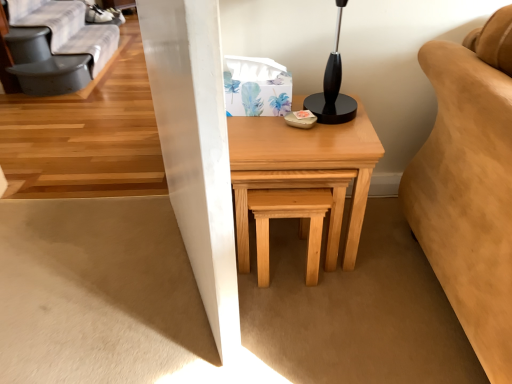
Describe the element at coordinates (311, 156) in the screenshot. This screenshot has height=384, width=512. I see `natural wood table at center` at that location.

The image size is (512, 384). I want to click on natural wood table at center, so click(x=311, y=156).

In order to face gray fabric futon at upper left, should I rotate leftwards or rightwards?

To face it directly, rotate left by 25.510 degrees.

Describe the element at coordinates (56, 45) in the screenshot. I see `gray fabric futon at upper left` at that location.

Find the location of `natural wood table at center`. natural wood table at center is located at coordinates (311, 156).

Which object is positioned more to the left, gray fabric futon at upper left or natural wood table at center?

gray fabric futon at upper left is more to the left.

Which object is thinner, gray fabric futon at upper left or natural wood table at center?

gray fabric futon at upper left.

Is gray fabric futon at upper left aimed at natural wood table at center?

No, gray fabric futon at upper left is not aimed at natural wood table at center.

Does natural wood stool at center appear on the right side of gray fabric futon at upper left?

Indeed, natural wood stool at center is positioned on the right side of gray fabric futon at upper left.

Is natural wood stool at center wider than gray fabric futon at upper left?

No, natural wood stool at center is not wider than gray fabric futon at upper left.

From a real-world perspective, is natural wood stool at center below gray fabric futon at upper left?

Yes, from a real-world perspective, natural wood stool at center is under gray fabric futon at upper left.

From the image's perspective, which is below, gray fabric futon at upper left or natural wood stool at center?

natural wood stool at center is shown below in the image.

Measure the distance between gray fabric futon at upper left and natural wood stool at center.

A distance of 7.24 feet exists between gray fabric futon at upper left and natural wood stool at center.

Based on the photo, does gray fabric futon at upper left touch natural wood stool at center?

No.

Identify the location of futon lying behind the natural wood stool at center. (56, 45).

Can you confirm if natural wood table at center is wider than gray fabric futon at upper left?

Correct, the width of natural wood table at center exceeds that of gray fabric futon at upper left.

Is natural wood table at center outside of gray fabric futon at upper left?

Yes, natural wood table at center is not within gray fabric futon at upper left.

Who is taller, natural wood table at center or gray fabric futon at upper left?

With more height is natural wood table at center.

From the image's perspective, is natural wood table at center above or below gray fabric futon at upper left?

From the image's perspective, natural wood table at center appears below gray fabric futon at upper left.

Is natural wood stool at center beside natural wood table at center?

No, natural wood stool at center is not beside natural wood table at center.

The height and width of the screenshot is (384, 512). I want to click on table positioned vertically above the natural wood stool at center (from a real-world perspective), so click(311, 156).

Considering the positions of objects natural wood stool at center and natural wood table at center in the image provided, who is more to the right, natural wood stool at center or natural wood table at center?

Positioned to the right is natural wood table at center.

Which object is more forward, natural wood table at center or natural wood stool at center?

natural wood table at center is closer to the camera.

Is natural wood table at center oriented towards natural wood stool at center?

Yes, natural wood table at center is aimed at natural wood stool at center.

Which of these two, natural wood table at center or natural wood stool at center, is wider?

With larger width is natural wood table at center.

Can you tell me how much natural wood table at center and natural wood stool at center differ in facing direction?

The facing directions of natural wood table at center and natural wood stool at center are 0.000489 degrees apart.

The height and width of the screenshot is (384, 512). I want to click on table below the gray fabric futon at upper left (from a real-world perspective), so click(x=311, y=156).

Where is `futon above the natural wood stool at center (from a real-world perspective)`? This screenshot has height=384, width=512. futon above the natural wood stool at center (from a real-world perspective) is located at coordinates (56, 45).

Estimate the real-world distances between objects in this image. Which object is further from natural wood table at center, gray fabric futon at upper left or natural wood stool at center?

gray fabric futon at upper left.

Considering their positions, is natural wood table at center positioned closer to natural wood stool at center than gray fabric futon at upper left?

The object closer to natural wood stool at center is natural wood table at center.

Considering their positions, is natural wood stool at center positioned closer to natural wood table at center than gray fabric futon at upper left?

The object closer to natural wood table at center is natural wood stool at center.

Which object lies further to the anchor point gray fabric futon at upper left, natural wood table at center or natural wood stool at center?

natural wood stool at center lies further to gray fabric futon at upper left than the other object.

From the image, which object appears to be nearer to gray fabric futon at upper left, natural wood stool at center or natural wood table at center?

natural wood table at center is positioned closer to the anchor gray fabric futon at upper left.

Which object lies nearer to the anchor point natural wood stool at center, gray fabric futon at upper left or natural wood table at center?

Based on the image, natural wood table at center appears to be nearer to natural wood stool at center.

Find the location of a particular element. The width and height of the screenshot is (512, 384). stool situated between gray fabric futon at upper left and natural wood table at center from left to right is located at coordinates (289, 217).